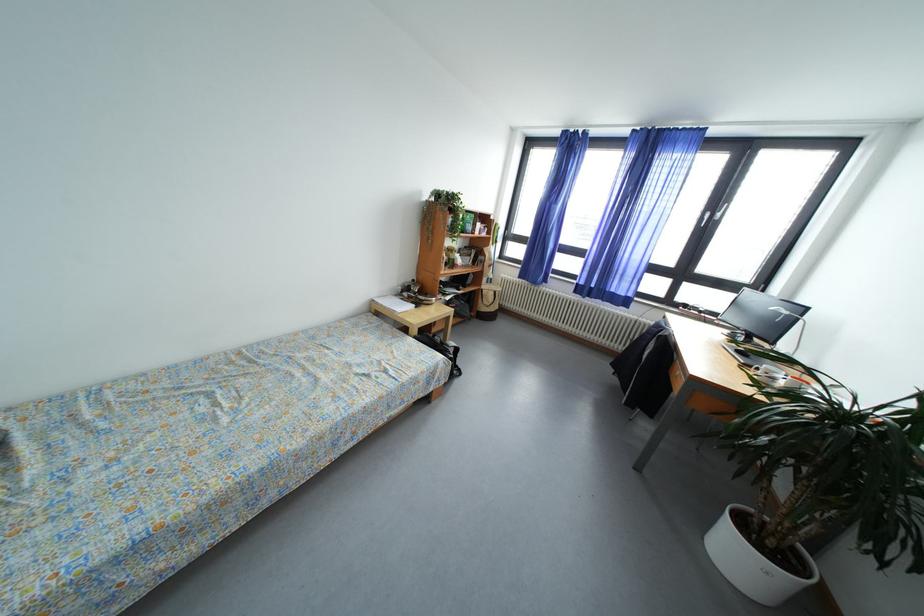
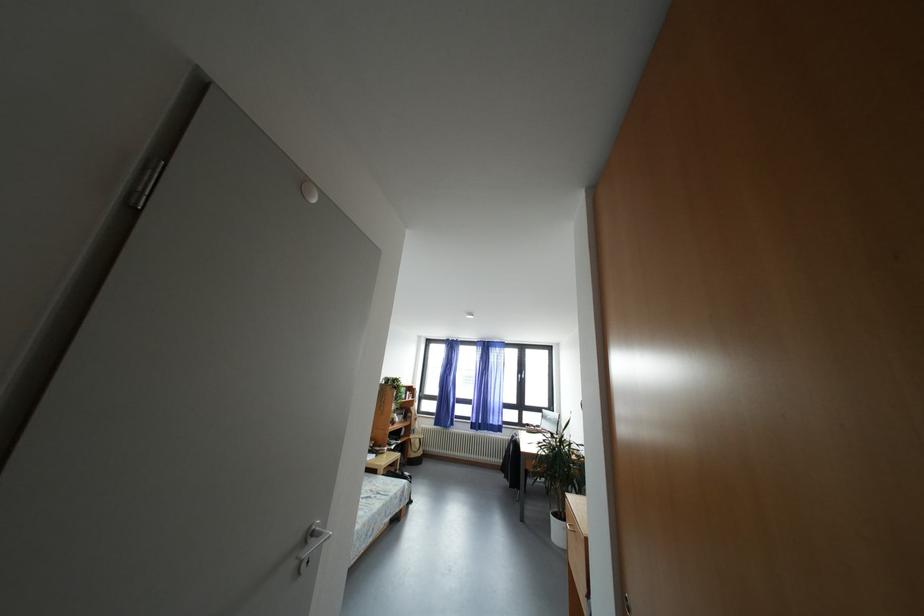
Locate, in the second image, the point that corresponds to (582,302) in the first image.

(480, 437)